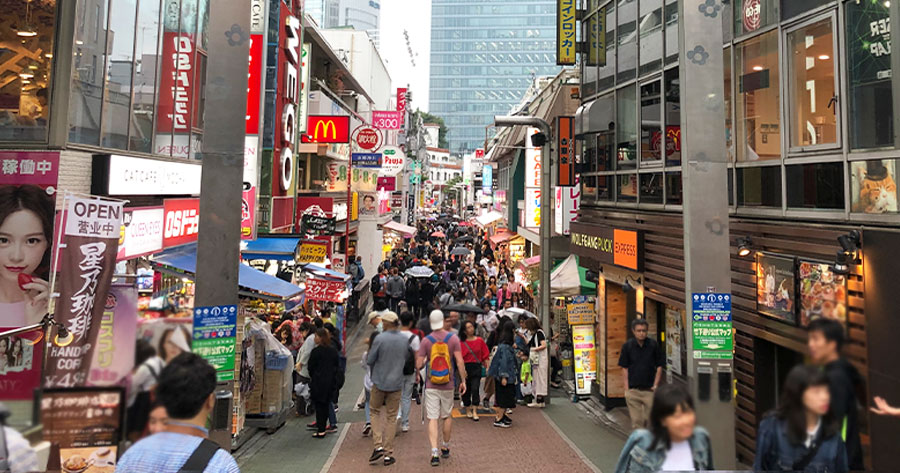
Locate an element on the screen. This screenshot has width=900, height=473. window is located at coordinates (796, 102).